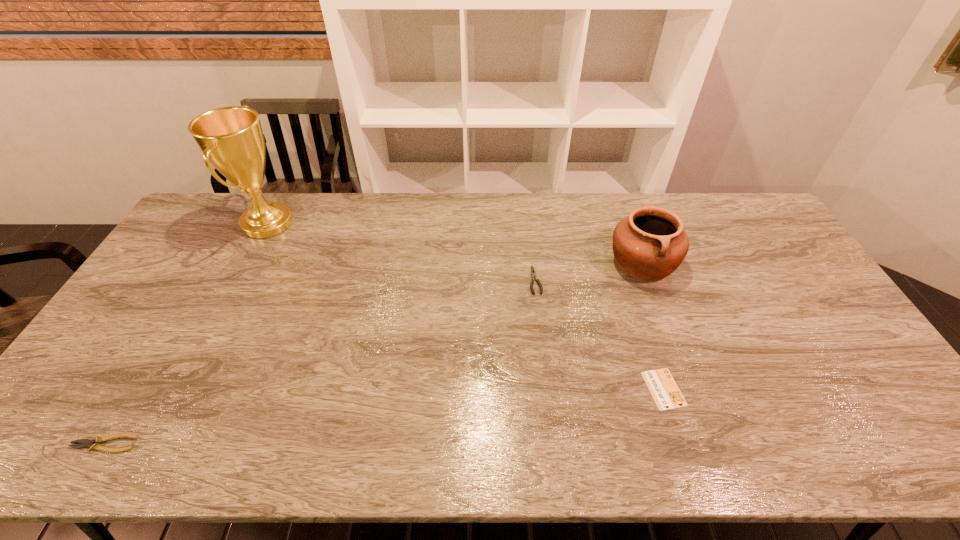
Find the location of `vacant space located on the back of the right pliers`. vacant space located on the back of the right pliers is located at coordinates (532, 251).

The height and width of the screenshot is (540, 960). Find the location of `free point located 0.180m on the back of the nearest object`. free point located 0.180m on the back of the nearest object is located at coordinates (150, 368).

Find the location of a particular element. This screenshot has height=540, width=960. vacant space situated on the right of the fourth farthest object is located at coordinates (706, 389).

Identify the location of object that is at the far edge. The height and width of the screenshot is (540, 960). (231, 138).

At what (x,y) coordinates should I click in order to perform the action: click on object that is at the near edge. Please return your answer as a coordinate pair (x, y). The height and width of the screenshot is (540, 960). Looking at the image, I should click on (94, 444).

I want to click on object present at the left edge, so (x=94, y=444).

Where is `object present at the near left corner`? The width and height of the screenshot is (960, 540). object present at the near left corner is located at coordinates (94, 444).

Find the location of `vacant space at the far edge of the desktop`. vacant space at the far edge of the desktop is located at coordinates (318, 209).

The height and width of the screenshot is (540, 960). In the image, there is a desktop. In order to click on vacant space at the near edge in this screenshot , I will do `click(269, 425)`.

You are a GUI agent. You are given a task and a screenshot of the screen. Output one action in this format:
    pyautogui.click(x=<x>, y=<y>)
    Task: Click on the vacant space at the left edge of the desktop
    The height and width of the screenshot is (540, 960).
    Given the screenshot: What is the action you would take?
    pyautogui.click(x=128, y=406)